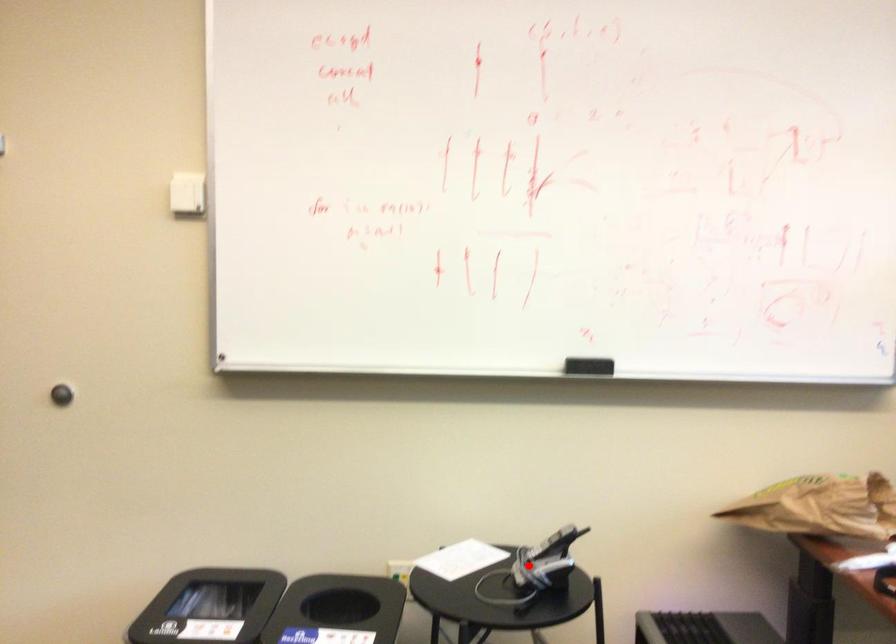
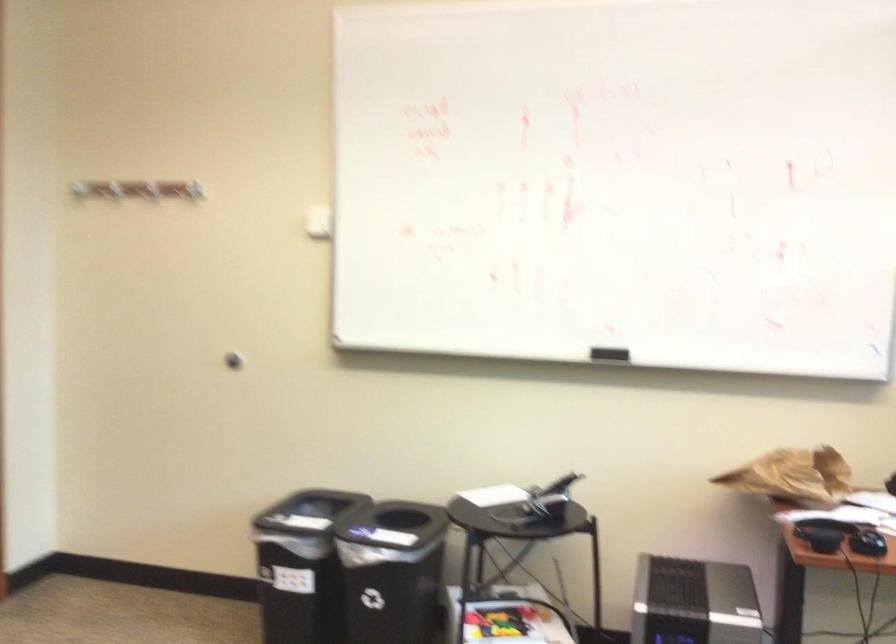
Where in the second image is the point corresponding to the highlighted location from the first image?

(539, 503)